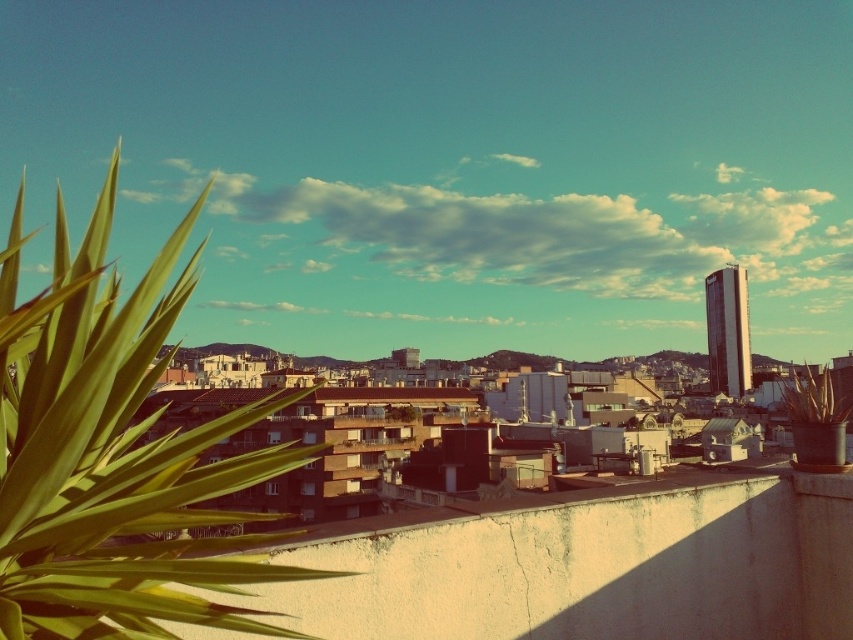
Who is shorter, green leafy plant at left or green leafy plant at upper left?

Standing shorter between the two is green leafy plant at upper left.

The height and width of the screenshot is (640, 853). What are the coordinates of `green leafy plant at left` in the screenshot? It's located at (113, 452).